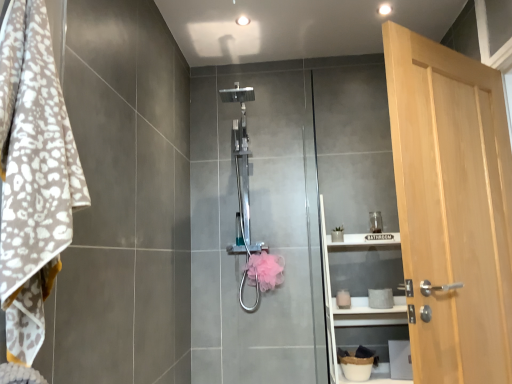
What do you see at coordinates (452, 207) in the screenshot? The height and width of the screenshot is (384, 512). I see `light brown wood door at right` at bounding box center [452, 207].

The height and width of the screenshot is (384, 512). What do you see at coordinates (356, 298) in the screenshot?
I see `white matte shelf at center` at bounding box center [356, 298].

You are a GUI agent. You are given a task and a screenshot of the screen. Output one action in this format:
    pyautogui.click(x=<x>, y=<y>)
    Task: Click on the light brown wood door at right
    
    Given the screenshot: What is the action you would take?
    pyautogui.click(x=452, y=207)

Is white leopard print towel at left inside or outside of white matte shelf at center?

The correct answer is: outside.

From a real-world perspective, is white leopard print towel at left located beneath white matte shelf at center?

No.

From the image's perspective, which object appears higher, white leopard print towel at left or white matte shelf at center?

From the image's view, white leopard print towel at left is above.

Is white leopard print towel at left taller than white matte shelf at center?

No.

Considering the positions of point (419, 173) and point (248, 192), is point (419, 173) closer or farther from the camera than point (248, 192)?

Point (419, 173).

Can you confirm if light brown wood door at right is positioned to the right of polished chrome shower at center?

Correct, you'll find light brown wood door at right to the right of polished chrome shower at center.

Does light brown wood door at right turn towards polished chrome shower at center?

No, light brown wood door at right does not turn towards polished chrome shower at center.

Is pink fluffy hand towel at center to the right of light brown wood door at right from the viewer's perspective?

No.

How far apart are pink fluffy hand towel at center and light brown wood door at right?

pink fluffy hand towel at center and light brown wood door at right are 1.26 meters apart.

Where is `door on the right of the pink fluffy hand towel at center`? door on the right of the pink fluffy hand towel at center is located at coordinates (452, 207).

Is point (273, 279) more distant than point (506, 128)?

Yes.

Which of these two, polished chrome shower at center or light brown wood door at right, stands taller?

Standing taller between the two is light brown wood door at right.

Does polished chrome shower at center appear on the left side of light brown wood door at right?

Indeed, polished chrome shower at center is positioned on the left side of light brown wood door at right.

Which of these two, polished chrome shower at center or light brown wood door at right, is smaller?

polished chrome shower at center.

From a real-world perspective, is polished chrome shower at center on white matte shelf at center?

Yes, from a real-world perspective, polished chrome shower at center is over white matte shelf at center

Is polished chrome shower at center far away from white matte shelf at center?

polished chrome shower at center is actually quite close to white matte shelf at center.

Is polished chrome shower at center facing towards white matte shelf at center?

No, polished chrome shower at center is not aimed at white matte shelf at center.

Between polished chrome shower at center and white matte shelf at center, which one has more height?

polished chrome shower at center is taller.

Is white leopard print towel at left at the back of pink fluffy hand towel at center?

That's not correct — pink fluffy hand towel at center is not looking away from white leopard print towel at left.

From a real-world perspective, between pink fluffy hand towel at center and white leopard print towel at left, who is vertically higher?

white leopard print towel at left, from a real-world perspective.

This screenshot has width=512, height=384. What are the coordinates of `hand towel located underneath the white leopard print towel at left (from a real-world perspective)` in the screenshot? It's located at (265, 270).

Can you confirm if pink fluffy hand towel at center is thinner than white leopard print towel at left?

Yes, pink fluffy hand towel at center is thinner than white leopard print towel at left.

Is white matte shelf at center aimed at light brown wood door at right?

Yes, white matte shelf at center is facing light brown wood door at right.

Can you confirm if white matte shelf at center is wider than light brown wood door at right?

Correct, the width of white matte shelf at center exceeds that of light brown wood door at right.

Is white matte shelf at center situated inside light brown wood door at right or outside?

white matte shelf at center cannot be found inside light brown wood door at right.

From a real-world perspective, which object rests below the other?

From a 3D spatial view, white matte shelf at center is below.

Where is `shelf located on the right of white leopard print towel at left`? Image resolution: width=512 pixels, height=384 pixels. shelf located on the right of white leopard print towel at left is located at coordinates (356, 298).

You are a GUI agent. You are given a task and a screenshot of the screen. Output one action in this format:
    pyautogui.click(x=<x>, y=<y>)
    Task: Click on the shower above the light brown wood door at right (from a real-world perspective)
    This screenshot has width=512, height=384.
    Given the screenshot: What is the action you would take?
    [x=241, y=169]

Looking at the image, which one is located further to white matte shelf at center, light brown wood door at right or pink fluffy hand towel at center?

Based on the image, light brown wood door at right appears to be further to white matte shelf at center.

Looking at the image, which one is located further to pink fluffy hand towel at center, white leopard print towel at left or white matte shelf at center?

Among the two, white leopard print towel at left is located further to pink fluffy hand towel at center.

Looking at the image, which one is located further to light brown wood door at right, pink fluffy hand towel at center or polished chrome shower at center?

polished chrome shower at center.

Considering their positions, is white matte shelf at center positioned closer to light brown wood door at right than pink fluffy hand towel at center?

white matte shelf at center is positioned closer to the anchor light brown wood door at right.

Based on their spatial positions, is light brown wood door at right or white matte shelf at center closer to white leopard print towel at left?

Among the two, light brown wood door at right is located nearer to white leopard print towel at left.

Looking at the image, which one is located closer to polished chrome shower at center, white leopard print towel at left or pink fluffy hand towel at center?

Among the two, pink fluffy hand towel at center is located nearer to polished chrome shower at center.

From the picture: Considering their positions, is white leopard print towel at left positioned closer to white matte shelf at center than polished chrome shower at center?

The object closer to white matte shelf at center is polished chrome shower at center.

Considering their positions, is light brown wood door at right positioned further to white leopard print towel at left than polished chrome shower at center?

polished chrome shower at center is further to white leopard print towel at left.

At what (x,y) coordinates should I click in order to perform the action: click on door located between white leopard print towel at left and pink fluffy hand towel at center in the depth direction. Please return your answer as a coordinate pair (x, y). Looking at the image, I should click on (452, 207).

Identify the location of door located between white leopard print towel at left and polished chrome shower at center in the depth direction. The width and height of the screenshot is (512, 384). (452, 207).

This screenshot has height=384, width=512. What are the coordinates of `shelf between light brown wood door at right and polished chrome shower at center from front to back` in the screenshot? It's located at (x=356, y=298).

You are a GUI agent. You are given a task and a screenshot of the screen. Output one action in this format:
    pyautogui.click(x=<x>, y=<y>)
    Task: Click on the shelf located between light brown wood door at right and pink fluffy hand towel at center in the depth direction
    The width and height of the screenshot is (512, 384).
    Given the screenshot: What is the action you would take?
    pyautogui.click(x=356, y=298)